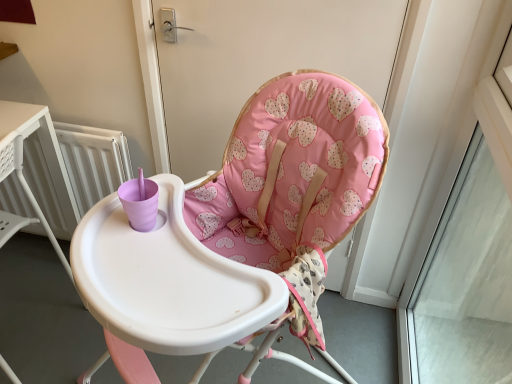
Measure the distance between transparent glass window at upper right and camera.

They are 1.14 meters apart.

This screenshot has width=512, height=384. What do you see at coordinates (261, 61) in the screenshot? I see `pink fabric cushion at center` at bounding box center [261, 61].

Where is `transparent glass window at upper right`? This screenshot has width=512, height=384. transparent glass window at upper right is located at coordinates (466, 282).

From a real-world perspective, who is located higher, pink fabric cushion at center or white radiator at left?

pink fabric cushion at center, from a real-world perspective.

Identify the location of screen door in front of the white radiator at left. The height and width of the screenshot is (384, 512). (261, 61).

Can you confirm if pink fabric cushion at center is taller than white radiator at left?

In fact, pink fabric cushion at center may be shorter than white radiator at left.

Which object is positioned more to the left, pink fabric cushion at center or white radiator at left?

Positioned to the left is white radiator at left.

Is the position of transparent glass window at upper right less distant than that of pink fabric highchair at center?

No, it is not.

How many degrees apart are the facing directions of transparent glass window at upper right and pink fabric highchair at center?

The angular difference between transparent glass window at upper right and pink fabric highchair at center is 47.5 degrees.

Is transparent glass window at upper right at the left side of pink fabric highchair at center?

Incorrect, transparent glass window at upper right is not on the left side of pink fabric highchair at center.

Between point (482, 335) and point (247, 224), which one is positioned behind?

The point (482, 335) is more distant.

Is white radiator at left next to pink fabric cushion at center and touching it?

No, white radiator at left is not beside pink fabric cushion at center.

Is white radiator at left oriented away from pink fabric cushion at center?

white radiator at left does not have its back to pink fabric cushion at center.

Does point (77, 174) appear closer or farther from the camera than point (286, 35)?

Point (77, 174) appears to be farther away from the viewer than point (286, 35).

Based on the photo, is white radiator at left shorter than pink fabric highchair at center?

Indeed, white radiator at left has a lesser height compared to pink fabric highchair at center.

Measure the distance between white radiator at left and pink fabric highchair at center.

white radiator at left and pink fabric highchair at center are 71.94 centimeters apart from each other.

From a real-world perspective, is white radiator at left on pink fabric highchair at center?

No, from a real-world perspective, white radiator at left is not on top of pink fabric highchair at center.

Is white radiator at left bigger than pink fabric highchair at center?

No, white radiator at left is not bigger than pink fabric highchair at center.

Looking at this image, visually, is pink fabric highchair at center positioned to the left or to the right of transparent glass window at upper right?

In the image, pink fabric highchair at center appears on the left side of transparent glass window at upper right.

Looking at this image, is pink fabric highchair at center oriented away from transparent glass window at upper right?

Correct, pink fabric highchair at center is looking away from transparent glass window at upper right.

Which is in front, pink fabric highchair at center or transparent glass window at upper right?

pink fabric highchair at center is in front.

Does pink fabric highchair at center touch pink fabric cushion at center?

No, pink fabric highchair at center is not beside pink fabric cushion at center.

Considering the sizes of pink fabric highchair at center and pink fabric cushion at center in the image, is pink fabric highchair at center taller or shorter than pink fabric cushion at center?

pink fabric highchair at center is taller than pink fabric cushion at center.

There is a pink fabric highchair at center. Identify the location of screen door above it (from a real-world perspective). This screenshot has width=512, height=384. (261, 61).

Which of these two, pink fabric highchair at center or pink fabric cushion at center, is thinner?

With smaller width is pink fabric cushion at center.

Can you confirm if white radiator at left is positioned to the right of transparent glass window at upper right?

No, white radiator at left is not to the right of transparent glass window at upper right.

Is transparent glass window at upper right at the back of white radiator at left?

No, transparent glass window at upper right is not at the back of white radiator at left.

Based on the photo, how different are the orientations of white radiator at left and transparent glass window at upper right in degrees?

white radiator at left and transparent glass window at upper right are facing 89.9 degrees away from each other.

Does point (94, 143) come farther from viewer compared to point (407, 310)?

No, (94, 143) is closer to viewer.

Where is `screen door lying above the white radiator at left (from the image's perspective)`? This screenshot has height=384, width=512. screen door lying above the white radiator at left (from the image's perspective) is located at coordinates (261, 61).

Identify the location of chair located on the left of transparent glass window at upper right. The width and height of the screenshot is (512, 384). (293, 186).

Which object lies nearer to the anchor point pink fabric highchair at center, white radiator at left or transparent glass window at upper right?

Among the two, transparent glass window at upper right is located nearer to pink fabric highchair at center.

Considering their positions, is pink fabric cushion at center positioned closer to pink fabric highchair at center than transparent glass window at upper right?

pink fabric cushion at center.

From the image, which object appears to be nearer to pink fabric highchair at center, transparent glass window at upper right or white radiator at left?

transparent glass window at upper right is closer to pink fabric highchair at center.

Based on their spatial positions, is transparent glass window at upper right or pink fabric highchair at center further from white radiator at left?

transparent glass window at upper right is positioned further to the anchor white radiator at left.

Estimate the real-world distances between objects in this image. Which object is closer to pink fabric cushion at center, transparent glass window at upper right or white radiator at left?

white radiator at left is closer to pink fabric cushion at center.

When comparing their distances from white radiator at left, does transparent glass window at upper right or pink fabric cushion at center seem further?

transparent glass window at upper right lies further to white radiator at left than the other object.

Which object lies further to the anchor point pink fabric cushion at center, pink fabric highchair at center or white radiator at left?

white radiator at left is further to pink fabric cushion at center.

Based on their spatial positions, is pink fabric cushion at center or pink fabric highchair at center closer to transparent glass window at upper right?

Based on the image, pink fabric highchair at center appears to be nearer to transparent glass window at upper right.

Identify the location of chair between white radiator at left and transparent glass window at upper right in the horizontal direction. This screenshot has height=384, width=512. (x=293, y=186).

You are a GUI agent. You are given a task and a screenshot of the screen. Output one action in this format:
    pyautogui.click(x=<x>, y=<y>)
    Task: Click on the window located between pink fabric highchair at center and pink fabric cushion at center in the depth direction
    This screenshot has width=512, height=384.
    Given the screenshot: What is the action you would take?
    pyautogui.click(x=466, y=282)

This screenshot has height=384, width=512. I want to click on screen door between pink fabric highchair at center and white radiator at left along the z-axis, so point(261,61).

This screenshot has height=384, width=512. I want to click on screen door located between white radiator at left and transparent glass window at upper right in the left-right direction, so click(261, 61).